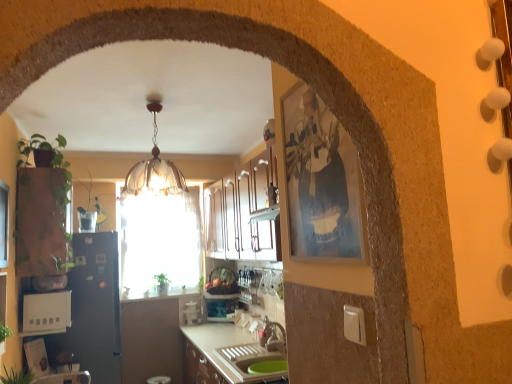
Measure the distance between white glossy sink at lower center and camera.

white glossy sink at lower center is 7.87 feet from camera.

Measure the distance between point (211, 308) and camera.

They are 4.24 meters apart.

Measure the distance between white plastic toaster at lower left, which is counted as the 1th appliance, starting from the front, and camera.

white plastic toaster at lower left, which is counted as the 1th appliance, starting from the front, and camera are 9.15 feet apart.

What do you see at coordinates (225, 355) in the screenshot? I see `white glossy countertop at center` at bounding box center [225, 355].

Image resolution: width=512 pixels, height=384 pixels. Describe the element at coordinates (162, 280) in the screenshot. I see `green leafy plant at center, which is the 1th plant in bottom-to-top order` at that location.

Identify the location of white glossy counter top at center. This screenshot has width=512, height=384. pyautogui.click(x=158, y=294).

What's the angular difference between white glossy cabinets at center and translucent glass chandelier at center's facing directions?

The angular difference between white glossy cabinets at center and translucent glass chandelier at center is 89.5 degrees.

From a real-world perspective, between white glossy cabinets at center and translucent glass chandelier at center, who is vertically higher?

From a 3D spatial view, translucent glass chandelier at center is above.

Is white glossy cabinets at center further to camera compared to translucent glass chandelier at center?

Yes, it is.

From the image's perspective, which one is positioned lower, white glossy cabinets at center or translucent glass chandelier at center?

From the image's view, white glossy cabinets at center is below.

Who is bigger, white glossy cabinets at center or black matte refrigerator at left, the 2th appliance viewed from the left?

white glossy cabinets at center is bigger.

Is white glossy cabinets at center next to black matte refrigerator at left, the 2th appliance positioned from the right?

No, white glossy cabinets at center is not with black matte refrigerator at left, the 2th appliance positioned from the right.

Which of these two, white glossy cabinets at center or black matte refrigerator at left, the 2th appliance viewed from the left, stands taller?

Standing taller between the two is black matte refrigerator at left, the 2th appliance viewed from the left.

Is white glossy cabinets at center outside of black matte refrigerator at left, the 2th appliance viewed from the left?

Yes, white glossy cabinets at center is outside of black matte refrigerator at left, the 2th appliance viewed from the left.

Looking at this image, from the image's perspective, is white glossy countertop at center beneath white glossy sink at lower center?

Indeed, from the image's perspective, white glossy countertop at center is shown beneath white glossy sink at lower center.

Which object is further away from the camera taking this photo, white glossy countertop at center or white glossy sink at lower center?

white glossy sink at lower center is behind.

Which is correct: white glossy countertop at center is inside white glossy sink at lower center, or outside of it?

white glossy countertop at center is not enclosed by white glossy sink at lower center.

From a real-world perspective, between black matte refrigerator at left, the 2th appliance viewed from the left, and green leafy plant at left, positioned as the 1th plant in front-to-back order, who is vertically higher?

green leafy plant at left, positioned as the 1th plant in front-to-back order.

Considering the positions of objects black matte refrigerator at left, placed as the 2th appliance when sorted from front to back, and green leafy plant at left, which is the 2th plant in bottom-to-top order, in the image provided, who is more to the right, black matte refrigerator at left, placed as the 2th appliance when sorted from front to back, or green leafy plant at left, which is the 2th plant in bottom-to-top order,?

Positioned to the right is green leafy plant at left, which is the 2th plant in bottom-to-top order.

In the scene shown: Can we say black matte refrigerator at left, which ranks as the 2th appliance in back-to-front order, lies outside green leafy plant at left, which is the 2th plant in bottom-to-top order?

Yes, black matte refrigerator at left, which ranks as the 2th appliance in back-to-front order, is not within green leafy plant at left, which is the 2th plant in bottom-to-top order.

Can you see black matte refrigerator at left, which ranks as the 2th appliance in back-to-front order, touching green leafy plant at left, positioned as the 1th plant in front-to-back order?

There is a gap between black matte refrigerator at left, which ranks as the 2th appliance in back-to-front order, and green leafy plant at left, positioned as the 1th plant in front-to-back order.

Does green leafy plant at left, which is the 2th plant in bottom-to-top order, appear on the left side of white glossy sink at lower center?

Yes, green leafy plant at left, which is the 2th plant in bottom-to-top order, is to the left of white glossy sink at lower center.

Between green leafy plant at left, which is the second plant from left to right, and white glossy sink at lower center, which one has smaller size?

With smaller size is green leafy plant at left, which is the second plant from left to right.

Is white glossy sink at lower center surrounded by green leafy plant at left, acting as the third plant starting from the back?

No, white glossy sink at lower center is located outside of green leafy plant at left, acting as the third plant starting from the back.

Locate an element on the screen. Image resolution: width=512 pixels, height=384 pixels. counter top beneath the wooden picture frame at right (from a real-world perspective) is located at coordinates (158, 294).

Is white glossy counter top at center far from wooden picture frame at right?

Yes, white glossy counter top at center and wooden picture frame at right are quite far apart.

Which object is positioned more to the left, white glossy counter top at center or wooden picture frame at right?

From the viewer's perspective, white glossy counter top at center appears more on the left side.

Locate an element on the screen. The height and width of the screenshot is (384, 512). the 1st appliance above the metallic silver toaster at center, which is the third appliance in front-to-back order (from a real-world perspective) is located at coordinates (93, 309).

From a real-world perspective, which object stands above the other?

black matte refrigerator at left, placed as the 2th appliance when sorted from front to back, is physically above.

Is black matte refrigerator at left, the 2th appliance positioned from the right, facing towards metallic silver toaster at center, the 1th appliance when ordered from right to left?

Yes, black matte refrigerator at left, the 2th appliance positioned from the right, is facing metallic silver toaster at center, the 1th appliance when ordered from right to left.

From the image's perspective, would you say black matte refrigerator at left, the 2th appliance viewed from the left, is shown under metallic silver toaster at center, the 1th appliance when ordered from right to left?

No.

The width and height of the screenshot is (512, 384). In order to click on light fixture above the white glossy cabinets at center (from a real-world perspective) in this screenshot , I will do `click(154, 166)`.

Locate an element on the screen. This screenshot has width=512, height=384. the 2nd appliance below the white glossy cabinets at center (from the image's perspective) is located at coordinates (93, 309).

Looking at the image, which one is located closer to white plastic toaster at lower left, marked as the 3th appliance in a right-to-left arrangement, green leafy plant at center, acting as the third plant starting from the front, or white glossy countertop at center?

white glossy countertop at center lies closer to white plastic toaster at lower left, marked as the 3th appliance in a right-to-left arrangement, than the other object.

Considering their positions, is green leafy plant at left, which is the second plant from left to right, positioned closer to green leafy plant at center, the first plant when ordered from right to left, than white plastic toaster at lower left, which is counted as the 1th appliance, starting from the front?

white plastic toaster at lower left, which is counted as the 1th appliance, starting from the front, is closer to green leafy plant at center, the first plant when ordered from right to left.

Consider the image. Estimate the real-world distances between objects in this image. Which object is further from green leafy plant at left, positioned as the 1th plant in front-to-back order, white glossy sink at lower center or white glossy countertop at center?

Among the two, white glossy countertop at center is located further to green leafy plant at left, positioned as the 1th plant in front-to-back order.

Looking at the image, which one is located further to white glossy sink at lower center, green matte plant at left, which is the first plant from left to right, or metallic silver toaster at center, the third appliance when ordered from left to right?

green matte plant at left, which is the first plant from left to right, lies further to white glossy sink at lower center than the other object.

Consider the image. Looking at the image, which one is located closer to white plastic toaster at lower left, which is counted as the 3th appliance, starting from the back, black matte refrigerator at left, the 2th appliance viewed from the left, or translucent glass chandelier at center?

black matte refrigerator at left, the 2th appliance viewed from the left.

Considering their positions, is translucent glass chandelier at center positioned further to wooden picture frame at right than white glossy counter top at center?

white glossy counter top at center is positioned further to the anchor wooden picture frame at right.

Based on their spatial positions, is white glossy cabinets at center or white glossy countertop at center further from black matte refrigerator at left, which ranks as the 2th appliance in back-to-front order?

white glossy cabinets at center is positioned further to the anchor black matte refrigerator at left, which ranks as the 2th appliance in back-to-front order.

When comparing their distances from white glossy countertop at center, does white glossy counter top at center or white plastic toaster at lower left, the 1th appliance from the left, seem further?

The object further to white glossy countertop at center is white plastic toaster at lower left, the 1th appliance from the left.

This screenshot has width=512, height=384. Identify the location of counter top between white glossy cabinets at center and green leafy plant at center, acting as the third plant starting from the front, from front to back. (158, 294).

Find the location of `appliance between green leafy plant at left, which is the 2th plant in bottom-to-top order, and black matte refrigerator at left, the 2th appliance positioned from the right, from front to back`. appliance between green leafy plant at left, which is the 2th plant in bottom-to-top order, and black matte refrigerator at left, the 2th appliance positioned from the right, from front to back is located at coordinates (46, 313).

You are a GUI agent. You are given a task and a screenshot of the screen. Output one action in this format:
    pyautogui.click(x=<x>, y=<y>)
    Task: Click on the sink positioned between translucent glass chandelier at center and metallic silver toaster at center, the first appliance when ordered from back to front, from near to far
    The image size is (512, 384).
    Given the screenshot: What is the action you would take?
    pyautogui.click(x=251, y=361)

This screenshot has width=512, height=384. I want to click on sink between wooden picture frame at right and white glossy counter top at center along the z-axis, so click(251, 361).